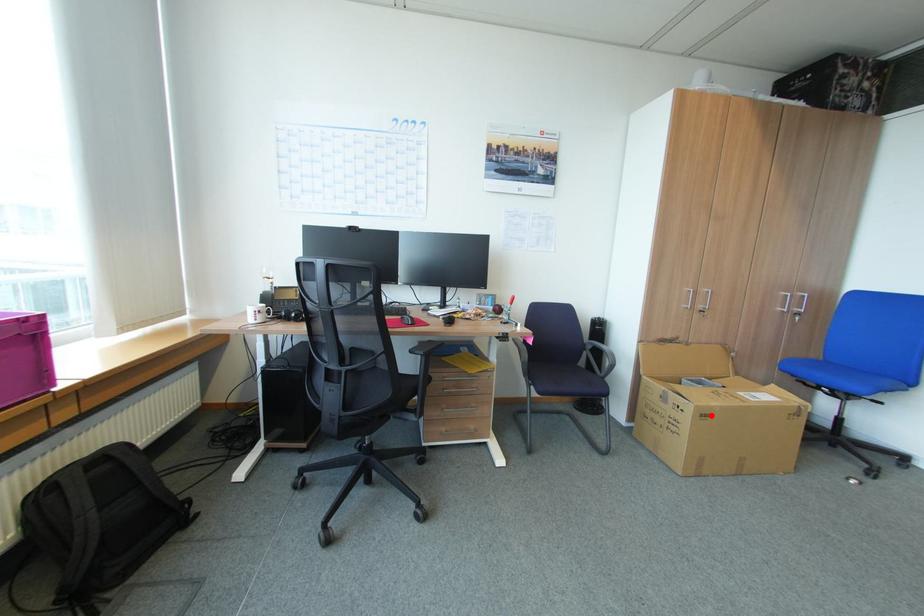
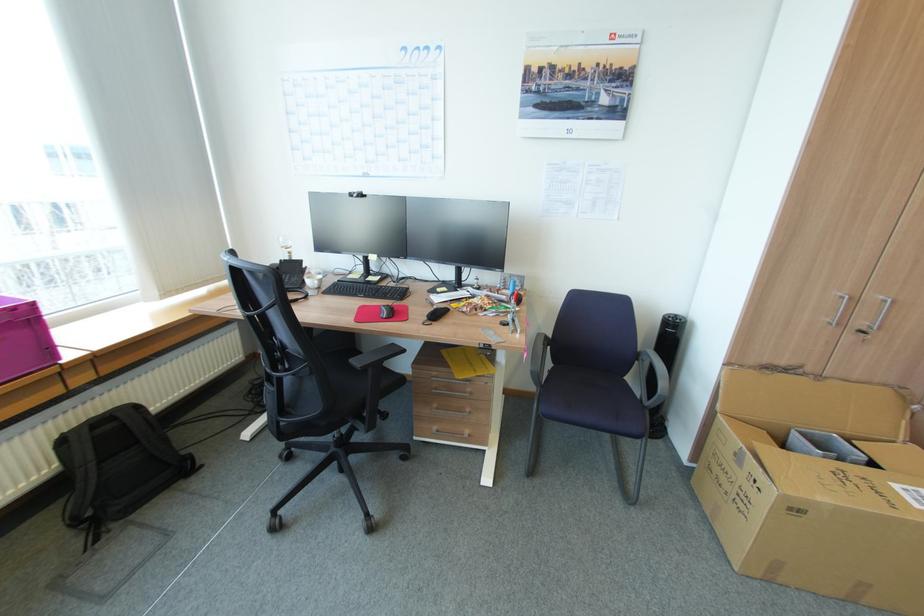
Find the pixel in the second image that matches the highlighted location in the first image.

(804, 511)